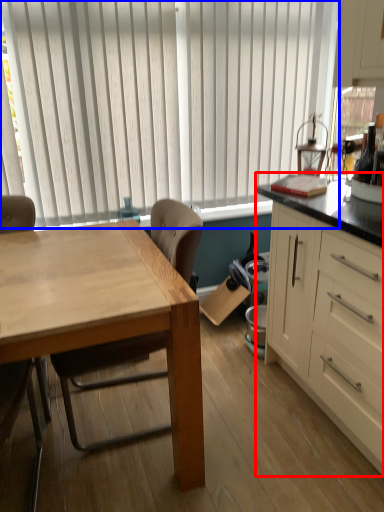
Question: Which object is closer to the camera taking this photo, cabinetry (highlighted by a red box) or window blind (highlighted by a blue box)?

Choices:
 (A) cabinetry
 (B) window blind

Answer: (A)